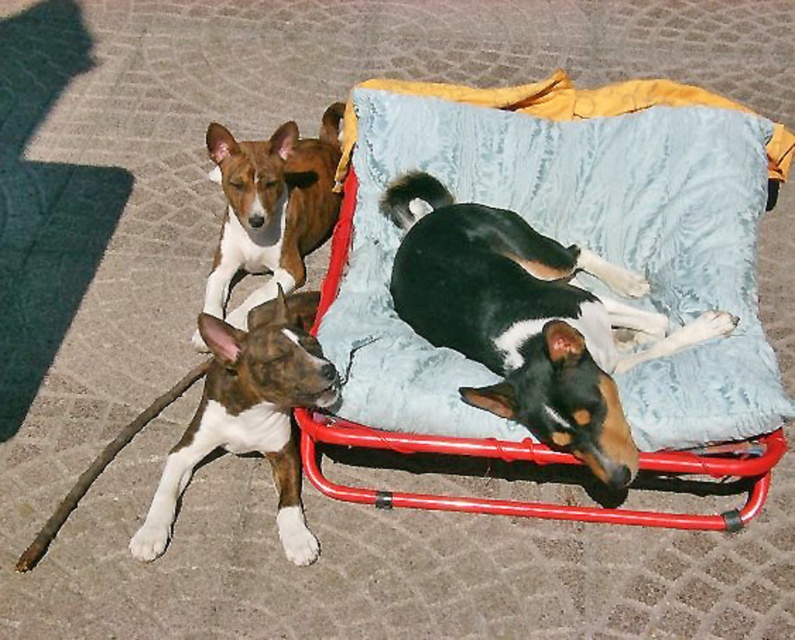
You are a photographer setting up a shoot. You want to place a small prop between the black and white fur at center and the blue velvety blanket at upper center. Based on their positions, where should you place the prop to ensure it is between them?

The prop should be placed between the black and white fur at center and the blue velvety blanket at upper center, positioning it above the black and white fur at center and below the blue velvety blanket at upper center since the black and white fur at center is below the blue velvety blanket at upper center.

You are standing in front of the red metal chair with a light blue cushion and a yellow border. There are two points marked on the chair. Which point, point 1 at coordinates (x=528, y=280) or point 2 at coordinates (x=708, y=104), is closer to you?

Point 1 at coordinates (x=528, y=280) is closer to you than point 2 at coordinates (x=708, y=104).